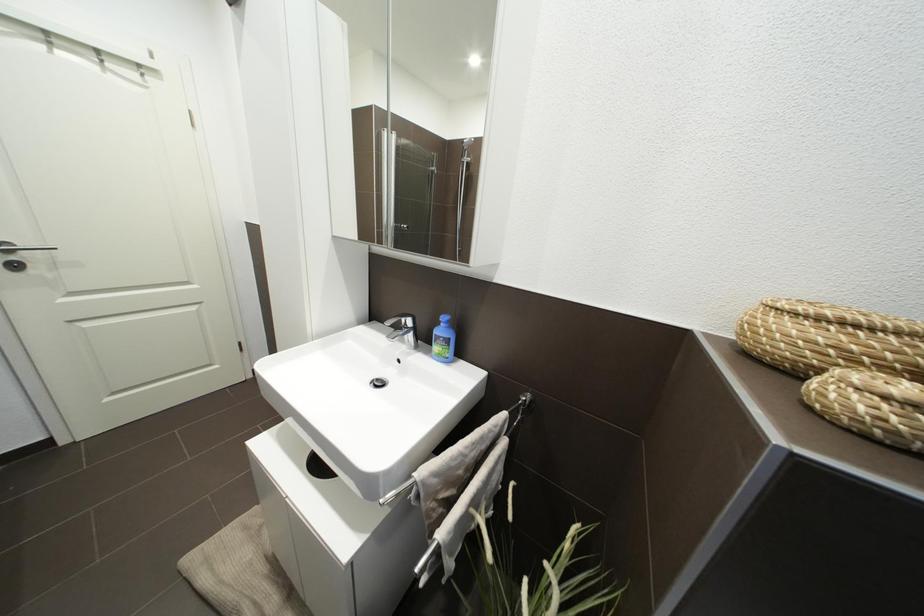
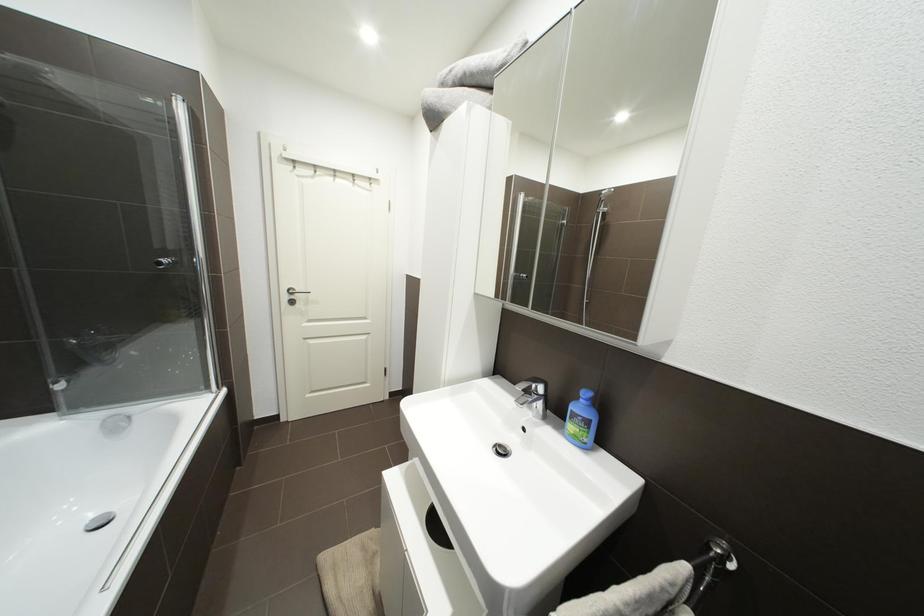
Question: The images are taken continuously from a first-person perspective. In which direction is your viewpoint rotating?

Choices:
 (A) Left
 (B) Right
 (C) Up
 (D) Down

Answer: (A)